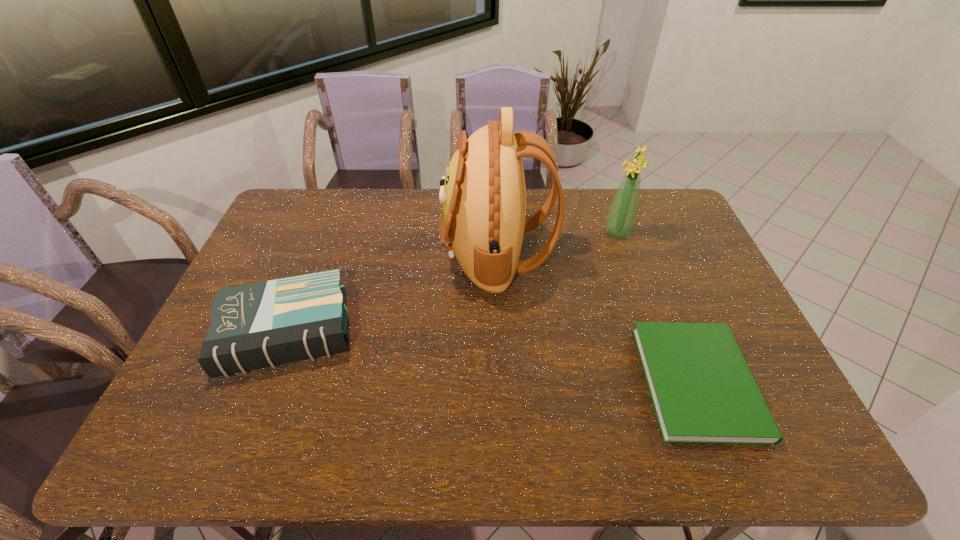
The image size is (960, 540). Find the location of `free location that satisfies the following two spatial constraints: 1. on the back side of the shorter paperback book; 2. on the front-facing side of the bouquet`. free location that satisfies the following two spatial constraints: 1. on the back side of the shorter paperback book; 2. on the front-facing side of the bouquet is located at coordinates (638, 233).

You are a GUI agent. You are given a task and a screenshot of the screen. Output one action in this format:
    pyautogui.click(x=<x>, y=<y>)
    Task: Click on the vacant space that satisfies the following two spatial constraints: 1. on the front-facing side of the tallest object; 2. on the left side of the shorter paperback book
    The height and width of the screenshot is (540, 960).
    Given the screenshot: What is the action you would take?
    pyautogui.click(x=502, y=382)

In order to click on vacant space that satisfies the following two spatial constraints: 1. on the front-facing side of the third object from right to left; 2. on the left side of the right paperback book in this screenshot , I will do `click(502, 382)`.

This screenshot has width=960, height=540. I want to click on vacant space that satisfies the following two spatial constraints: 1. on the back side of the shorter paperback book; 2. on the front-facing side of the bouquet, so click(638, 233).

Locate an element on the screen. The image size is (960, 540). free space that satisfies the following two spatial constraints: 1. on the front-facing side of the third shortest object; 2. on the left side of the shortest object is located at coordinates (669, 382).

Where is `free space that satisfies the following two spatial constraints: 1. on the back side of the right paperback book; 2. on the front-facing side of the bouquet`? free space that satisfies the following two spatial constraints: 1. on the back side of the right paperback book; 2. on the front-facing side of the bouquet is located at coordinates (638, 233).

This screenshot has height=540, width=960. What are the coordinates of `vacant space that satisfies the following two spatial constraints: 1. on the front-facing side of the shorter paperback book; 2. on the right side of the bouquet` in the screenshot? It's located at (669, 382).

Identify the location of vacant point that satisfies the following two spatial constraints: 1. on the front-facing side of the third object from right to left; 2. on the right side of the shorter paperback book. Image resolution: width=960 pixels, height=540 pixels. (502, 382).

At what (x,y) coordinates should I click in order to perform the action: click on free space in the image that satisfies the following two spatial constraints: 1. on the front-facing side of the shortest object; 2. on the right side of the tallest object. Please return your answer as a coordinate pair (x, y). Looking at the image, I should click on (502, 382).